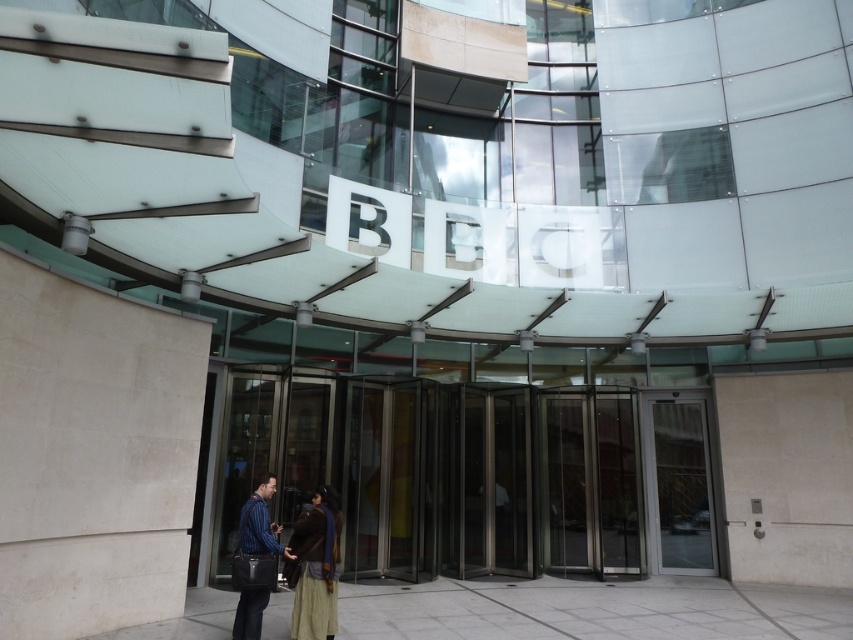
You are a security guard at the BBC building. You need to check if the brown textured coat at center and striped fabric shirt at center can both fit through the revolving door without any adjustments. The revolving door has a maximum width capacity of 1.2 meters. Can they pass through together?

The brown textured coat at center is wider than the striped fabric shirt at center. Since the revolving door has a maximum width capacity of 1.2 meters, and the coat alone is wider than the shirt, it depends on the combined width. However, the exact width of the coat isnecessary to determine if they can pass together. Without specific measurements, we cannot confirm.

You are standing at the entrance of the modern building and want to enter through the transparent glass door at center. According to the coordinates provided, is the point at position (682, 484) on the transparent glass door at center?

Yes, the point at (682, 484) is on the transparent glass door at center as stated in the description.

You are a photographer standing at the entrance of the modern building with the BBC sign. You see a person in a brown textured coat at center and another in a striped fabric shirt at center. Which clothing item is located to the right when facing the entrance?

The brown textured coat at center is positioned on the right side of the striped fabric shirt at center, so the brown textured coat at center is located to the right when facing the entrance.